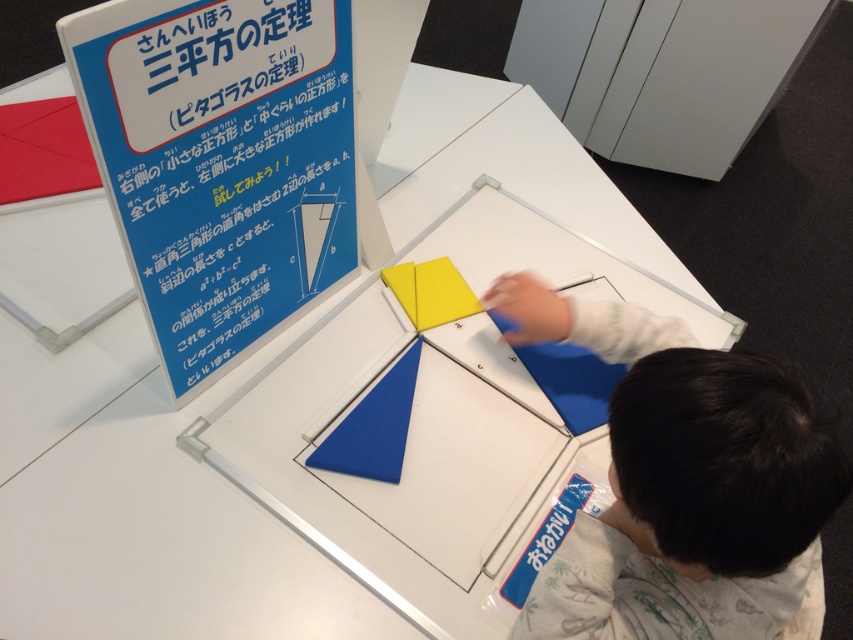
You are a visitor at the exhibit and want to read the blue paper sign at upper left and also check the smooth blue fabric at lower right. Which object is taller?

The blue paper sign at upper left is much taller than the smooth blue fabric at lower right.

Based on the photo, you are a museum visitor standing in front of the exhibit table. You see the blue paper sign at upper left and the smooth blue fabric at lower right. Which object is located higher up in the image?

The blue paper sign at upper left is positioned over the smooth blue fabric at lower right, meaning it is higher up in the image.

You are a visitor standing at the exhibit table and want to read the blue paper sign at upper left. If your arm can reach up to 60 centimeters, can you touch the sign?

The blue paper sign at upper left is 65.24 centimeters from the camera, which is beyond your arm reach of 60 centimeters. Therefore, you cannot touch it.